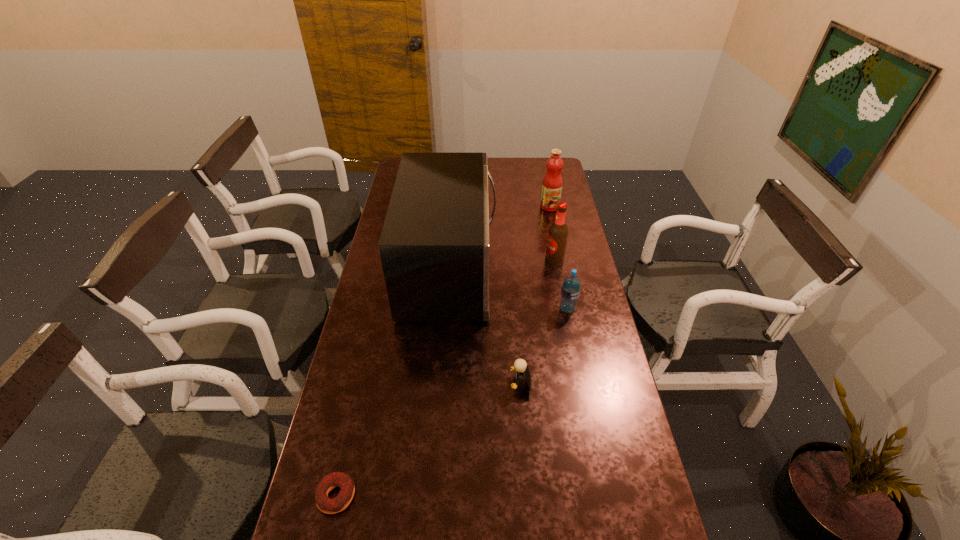
At what (x,y) coordinates should I click in order to perform the action: click on free space located on the front label of the fruit juice. Please return your answer as a coordinate pair (x, y). The image size is (960, 540). Looking at the image, I should click on (555, 234).

At what (x,y) coordinates should I click in order to perform the action: click on vacant space located 0.140m on the front of the beer bottle. Please return your answer as a coordinate pair (x, y). Looking at the image, I should click on (560, 293).

This screenshot has width=960, height=540. Identify the location of vacant space located 0.320m on the back of the fourth tallest object. (555, 246).

Locate an element on the screen. This screenshot has width=960, height=540. vacant space located on the front-facing side of the Lego is located at coordinates (480, 383).

The image size is (960, 540). I want to click on blank space located 0.220m on the front-facing side of the Lego, so click(x=438, y=383).

Where is `vacant region located 0.300m on the front-facing side of the Lego`? The width and height of the screenshot is (960, 540). vacant region located 0.300m on the front-facing side of the Lego is located at coordinates (412, 383).

Find the location of a particular element. The width and height of the screenshot is (960, 540). vacant space situated 0.280m on the back of the doughnut is located at coordinates (362, 383).

Identify the location of microwave oven that is at the left edge. Image resolution: width=960 pixels, height=540 pixels. (434, 247).

You are a GUI agent. You are given a task and a screenshot of the screen. Output one action in this format:
    pyautogui.click(x=<x>, y=<y>)
    Task: Click on the doughnut located in the left edge section of the desktop
    The image size is (960, 540).
    Given the screenshot: What is the action you would take?
    pyautogui.click(x=325, y=504)

Where is `fruit juice located at the right edge`? fruit juice located at the right edge is located at coordinates (552, 183).